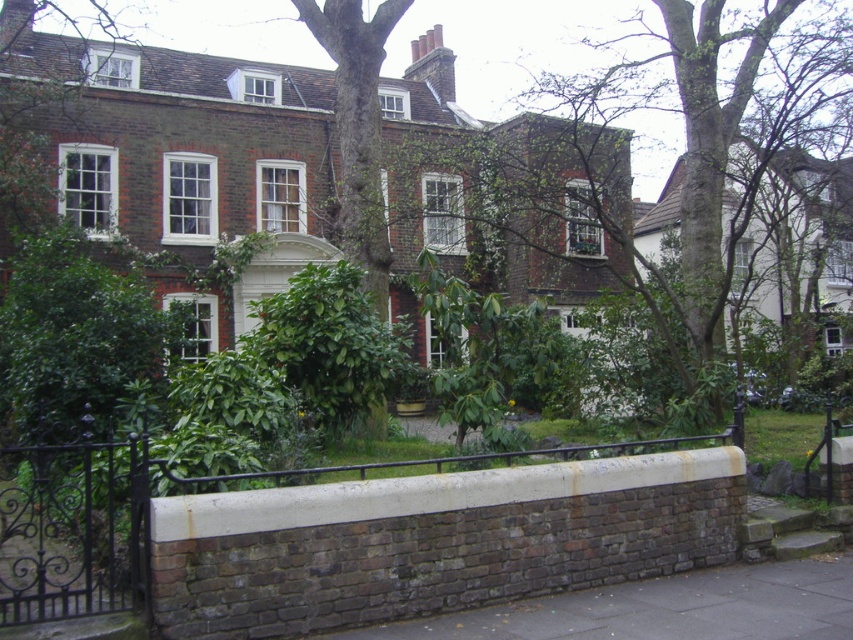
You are a delivery person approaching the house and need to place a large package on the ground. The package is too heavy to lift, so you must choose between placing it on the rusty brick wall at lower center or the brown brick pavement at lower center. Based on their widths, which surface can better accommodate the package?

The brown brick pavement at lower center has a greater width than the rusty brick wall at lower center, so it can better accommodate the large package.

You are standing at the entrance of the house and want to walk towards the rusty brick wall at lower center. Which direction should you walk relative to the brown brick pavement at lower center?

The rusty brick wall at lower center is located above the brown brick pavement at lower center, so you should walk forward towards the direction of the rusty brick wall at lower center relative to the brown brick pavement at lower center.

In the scene shown: You are standing at the entrance of the house and want to walk towards the rusty brick wall at lower center. What are the coordinates you should head towards?

You should head towards the coordinates point (149,513) to reach the rusty brick wall at lower center.